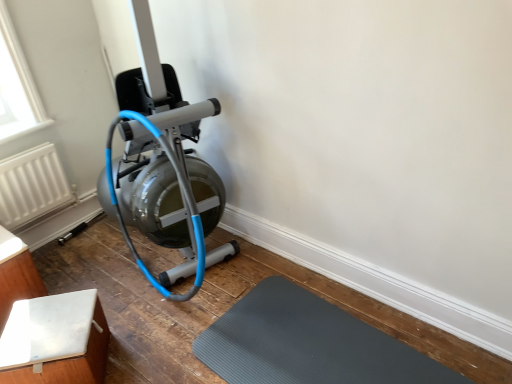
Find the location of a particular element. This screenshot has height=384, width=512. white matte table at lower left, the 1th furniture when ordered from right to left is located at coordinates (55, 340).

The height and width of the screenshot is (384, 512). Describe the element at coordinates (163, 165) in the screenshot. I see `matte silver stationary bicycle at left` at that location.

I want to click on gray rubber mat at lower center, so click(308, 344).

You are a GUI agent. You are given a task and a screenshot of the screen. Output one action in this format:
    pyautogui.click(x=<x>, y=<y>)
    Task: Click on the white matte table at lower left, the 2th furniture viewed from the left
    The height and width of the screenshot is (384, 512).
    Given the screenshot: What is the action you would take?
    pyautogui.click(x=55, y=340)

Considering the sizes of objects white textured radiator at left and white matte table at lower left, the 2th furniture viewed from the left, in the image provided, who is smaller, white textured radiator at left or white matte table at lower left, the 2th furniture viewed from the left,?

With smaller size is white textured radiator at left.

Is point (54, 161) positioned in front of point (89, 357)?

No, (54, 161) is further to viewer.

Between white textured radiator at left and white matte table at lower left, the 2th furniture viewed from the left, which one is positioned in front?

white matte table at lower left, the 2th furniture viewed from the left, is more forward.

From the image's perspective, between white textured radiator at left and white matte table at lower left, the 1th furniture when ordered from right to left, who is located below?

white matte table at lower left, the 1th furniture when ordered from right to left, is shown below in the image.

In the scene shown: Is matte silver stationary bicycle at left not close to gray rubber mat at lower center?

No, matte silver stationary bicycle at left is not far away from gray rubber mat at lower center.

Considering the relative sizes of matte silver stationary bicycle at left and gray rubber mat at lower center in the image provided, is matte silver stationary bicycle at left bigger than gray rubber mat at lower center?

Yes.

Is matte silver stationary bicycle at left further to the viewer compared to gray rubber mat at lower center?

Yes, it is.

From the image's perspective, is matte silver stationary bicycle at left on top of gray rubber mat at lower center?

Indeed, from the image's perspective, matte silver stationary bicycle at left is shown above gray rubber mat at lower center.

Between matte silver stationary bicycle at left and white matte table at lower left, the 2th furniture viewed from the left, which one is positioned in front?

Positioned in front is matte silver stationary bicycle at left.

From the image's perspective, is matte silver stationary bicycle at left under white matte table at lower left, the 2th furniture viewed from the left?

No, from the image's perspective, matte silver stationary bicycle at left is not beneath white matte table at lower left, the 2th furniture viewed from the left.

Is point (201, 110) closer to viewer compared to point (54, 371)?

No, (201, 110) is further to viewer.

Can you tell me how much matte silver stationary bicycle at left and white matte table at lower left, the 1th furniture when ordered from right to left, differ in facing direction?

The angular difference between matte silver stationary bicycle at left and white matte table at lower left, the 1th furniture when ordered from right to left, is 35.7 degrees.

From the image's perspective, is white matte table at lower left, the 1th furniture when ordered from right to left, under white matte table at lower left, positioned as the first furniture in left-to-right order?

Yes, from the image's perspective, white matte table at lower left, the 1th furniture when ordered from right to left, is beneath white matte table at lower left, positioned as the first furniture in left-to-right order.

Based on the photo, which object is positioned more to the right, white matte table at lower left, the 2th furniture viewed from the left, or white matte table at lower left, the 2th furniture from the right?

Positioned to the right is white matte table at lower left, the 2th furniture viewed from the left.

Is white matte table at lower left, the 2th furniture viewed from the left, oriented away from white matte table at lower left, the 2th furniture from the right?

No, white matte table at lower left, the 2th furniture viewed from the left,'s orientation is not away from white matte table at lower left, the 2th furniture from the right.

From the picture: Which object is further away from the camera taking this photo, white matte table at lower left, the 1th furniture when ordered from right to left, or white matte table at lower left, the 2th furniture from the right?

white matte table at lower left, the 2th furniture from the right, is further from the camera.

Considering the relative positions of matte silver stationary bicycle at left and white matte table at lower left, the 2th furniture from the right, in the image provided, is matte silver stationary bicycle at left behind white matte table at lower left, the 2th furniture from the right,?

No, matte silver stationary bicycle at left is in front of white matte table at lower left, the 2th furniture from the right.

Considering the positions of objects matte silver stationary bicycle at left and white matte table at lower left, the 2th furniture from the right, in the image provided, who is more to the left, matte silver stationary bicycle at left or white matte table at lower left, the 2th furniture from the right,?

white matte table at lower left, the 2th furniture from the right.

From the image's perspective, is matte silver stationary bicycle at left on white matte table at lower left, the 2th furniture from the right?

Yes, from the image's perspective, matte silver stationary bicycle at left is on top of white matte table at lower left, the 2th furniture from the right.

Considering the sizes of matte silver stationary bicycle at left and white matte table at lower left, the 2th furniture from the right, in the image, is matte silver stationary bicycle at left wider or thinner than white matte table at lower left, the 2th furniture from the right,?

Considering their sizes, matte silver stationary bicycle at left looks broader than white matte table at lower left, the 2th furniture from the right.

Is white textured radiator at left completely or partially outside of matte silver stationary bicycle at left?

Indeed, white textured radiator at left is completely outside matte silver stationary bicycle at left.

Considering the relative sizes of white textured radiator at left and matte silver stationary bicycle at left in the image provided, is white textured radiator at left wider than matte silver stationary bicycle at left?

No, white textured radiator at left is not wider than matte silver stationary bicycle at left.

From a real-world perspective, who is located higher, white textured radiator at left or matte silver stationary bicycle at left?

In real-world perspective, matte silver stationary bicycle at left is above.

Considering the relative sizes of matte silver stationary bicycle at left and white textured radiator at left in the image provided, is matte silver stationary bicycle at left taller than white textured radiator at left?

Yes.

Is matte silver stationary bicycle at left in front of or behind white textured radiator at left in the image?

Visually, matte silver stationary bicycle at left is located in front of white textured radiator at left.

The image size is (512, 384). What are the coordinates of `radiator below the matte silver stationary bicycle at left (from a real-world perspective)` in the screenshot? It's located at (32, 187).

How far apart are matte silver stationary bicycle at left and white textured radiator at left?

matte silver stationary bicycle at left and white textured radiator at left are 26.84 inches apart from each other.

Where is `the 2nd furniture in front of the white textured radiator at left`? the 2nd furniture in front of the white textured radiator at left is located at coordinates (55, 340).

What are the coordinates of `stationary bicycle located above the gray rubber mat at lower center (from the image's perspective)` in the screenshot? It's located at (163, 165).

Based on their spatial positions, is white textured radiator at left or matte silver stationary bicycle at left closer to white matte table at lower left, the 2th furniture viewed from the left?

matte silver stationary bicycle at left is positioned closer to the anchor white matte table at lower left, the 2th furniture viewed from the left.

From the image, which object appears to be farther from white textured radiator at left, matte silver stationary bicycle at left or gray rubber mat at lower center?

Based on the image, gray rubber mat at lower center appears to be further to white textured radiator at left.

When comparing their distances from white matte table at lower left, the 2th furniture viewed from the left, does gray rubber mat at lower center or white textured radiator at left seem further?

white textured radiator at left is further to white matte table at lower left, the 2th furniture viewed from the left.

Looking at the image, which one is located closer to white matte table at lower left, positioned as the first furniture in left-to-right order, matte silver stationary bicycle at left or white textured radiator at left?

Based on the image, white textured radiator at left appears to be nearer to white matte table at lower left, positioned as the first furniture in left-to-right order.

Which object lies further to the anchor point white textured radiator at left, white matte table at lower left, the 2th furniture viewed from the left, or white matte table at lower left, the 2th furniture from the right?

Based on the image, white matte table at lower left, the 2th furniture viewed from the left, appears to be further to white textured radiator at left.

When comparing their distances from white textured radiator at left, does white matte table at lower left, the 2th furniture from the right, or gray rubber mat at lower center seem closer?

white matte table at lower left, the 2th furniture from the right.

When comparing their distances from gray rubber mat at lower center, does white matte table at lower left, the 1th furniture when ordered from right to left, or white matte table at lower left, positioned as the first furniture in left-to-right order, seem closer?

Among the two, white matte table at lower left, the 1th furniture when ordered from right to left, is located nearer to gray rubber mat at lower center.

Looking at the image, which one is located further to matte silver stationary bicycle at left, white matte table at lower left, the 2th furniture viewed from the left, or white matte table at lower left, the 2th furniture from the right?

white matte table at lower left, the 2th furniture from the right, lies further to matte silver stationary bicycle at left than the other object.

The height and width of the screenshot is (384, 512). Find the location of `furniture that lies between white textured radiator at left and white matte table at lower left, the 2th furniture viewed from the left, from top to bottom`. furniture that lies between white textured radiator at left and white matte table at lower left, the 2th furniture viewed from the left, from top to bottom is located at coordinates click(16, 274).

At what (x,y) coordinates should I click in order to perform the action: click on stationary bicycle located between white matte table at lower left, the 2th furniture from the right, and gray rubber mat at lower center in the left-right direction. Please return your answer as a coordinate pair (x, y). Looking at the image, I should click on (163, 165).

The width and height of the screenshot is (512, 384). I want to click on furniture between white textured radiator at left and gray rubber mat at lower center, so click(55, 340).

The width and height of the screenshot is (512, 384). Find the location of `stationary bicycle between white matte table at lower left, the 1th furniture when ordered from right to left, and gray rubber mat at lower center`. stationary bicycle between white matte table at lower left, the 1th furniture when ordered from right to left, and gray rubber mat at lower center is located at coordinates (163, 165).